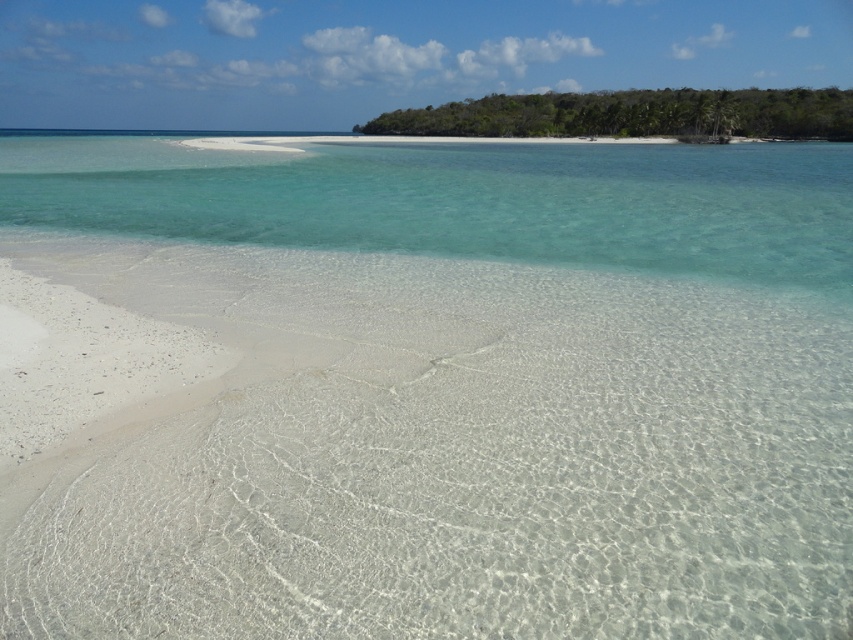
Question: Among these objects, which one is nearest to the camera?

Choices:
 (A) clear water at center
 (B) green leafy island at upper right

Answer: (A)

Question: Is white sand at lower left above clear water at center?

Choices:
 (A) yes
 (B) no

Answer: (B)

Question: Among these objects, which one is farthest from the camera?

Choices:
 (A) clear water at center
 (B) white sand at lower left

Answer: (A)

Question: Which of the following is the closest to the observer?

Choices:
 (A) (692, 120)
 (B) (363, 588)
 (C) (97, 193)

Answer: (B)

Question: Is white sand at lower left bigger than green leafy island at upper right?

Choices:
 (A) no
 (B) yes

Answer: (A)

Question: Can you confirm if white sand at lower left is wider than green leafy island at upper right?

Choices:
 (A) yes
 (B) no

Answer: (B)